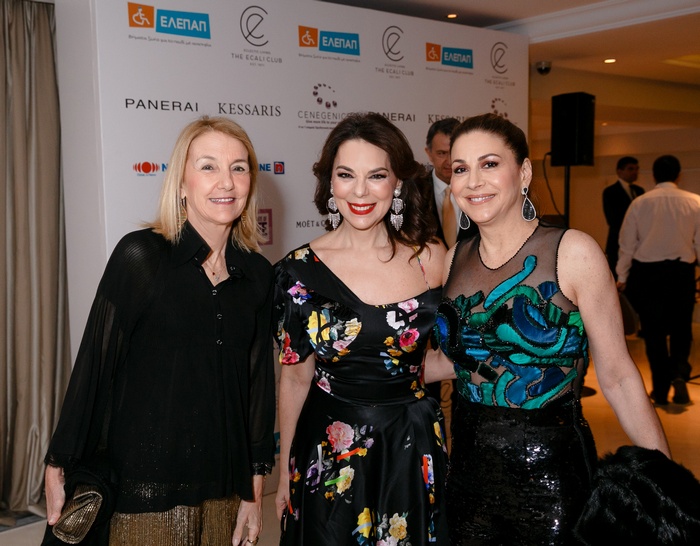
The width and height of the screenshot is (700, 546). I want to click on speaker, so click(x=579, y=130).